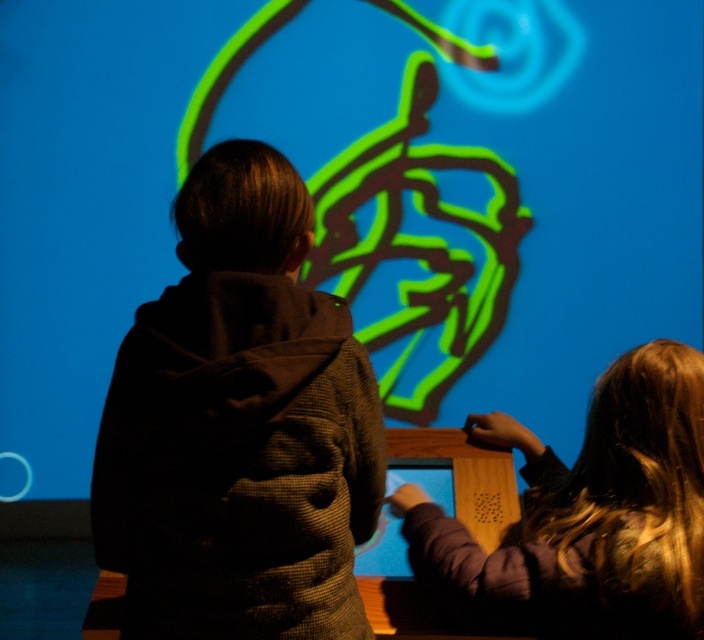
You are a photographer trying to capture both the dark brown textured hoodie at center and the smooth purple sweater at lower right in a single shot. Based on their positions, which one would you need to focus on first to ensure both are in focus?

The dark brown textured hoodie at center is above the smooth purple sweater at lower right, so you should focus on the dark brown textured hoodie at center first to ensure both are in focus.

You are standing 1.2 meters away from the projection wall. There is a point marked at coordinates point (303, 360) on the projection. Can you reach this point with your hand if you extend it fully?

The distance of point (303, 360) from viewer is 1.16 meters, which is slightly closer than your current position at 1.2 meters. Since you can extend your arm about 0.5 meters, the total reach would be 1.2m 0.5m 1.7 meters. The point is only 1.16 meters away, so you can easily reach it.